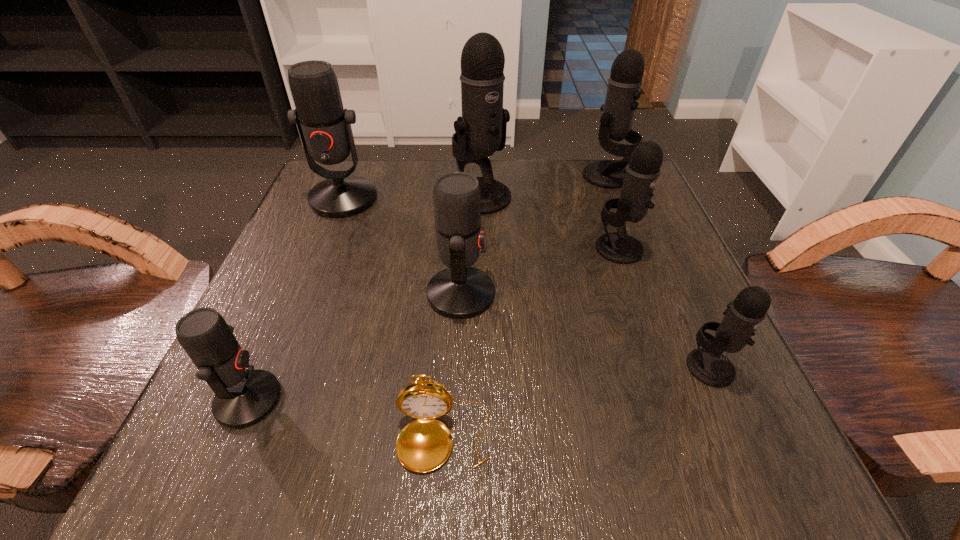
The image size is (960, 540). Identify the location of free spot between the second nearest black microphone and the nearest black microphone. (664, 308).

Find the location of `unoccupied area between the nearest red microphone and the shortest object`. unoccupied area between the nearest red microphone and the shortest object is located at coordinates (346, 418).

At what (x,y) coordinates should I click in order to perform the action: click on free spot between the tallest object and the third biggest black microphone. Please return your answer as a coordinate pair (x, y). This screenshot has width=960, height=540. Looking at the image, I should click on (550, 222).

Identify the location of vacant space in between the rightmost red microphone and the third smallest black microphone. (534, 235).

Where is `empty space that is in between the smallest black microphone and the farthest red microphone`? empty space that is in between the smallest black microphone and the farthest red microphone is located at coordinates (527, 283).

I want to click on free space between the smallest red microphone and the fourth nearest object, so click(x=354, y=347).

Where is `free space between the second nearest black microphone and the smallest red microphone`? The width and height of the screenshot is (960, 540). free space between the second nearest black microphone and the smallest red microphone is located at coordinates (434, 324).

Identify which object is located as the fifth nearest to the biggest red microphone. Please provide its 2D coordinates. Your answer should be formatted as a tuple, i.e. [(x, y)], where the tuple contains the x and y coordinates of a point satisfying the conditions above.

[(641, 174)]

Choose which object is the fifth nearest neighbor to the shortest object. Please provide its 2D coordinates. Your answer should be formatted as a tuple, i.e. [(x, y)], where the tuple contains the x and y coordinates of a point satisfying the conditions above.

[(481, 131)]

You are a GUI agent. You are given a task and a screenshot of the screen. Output one action in this format:
    pyautogui.click(x=<x>, y=<y>)
    Task: Click on the third closest microphone to the shortest object
    Image resolution: width=960 pixels, height=540 pixels.
    Given the screenshot: What is the action you would take?
    pyautogui.click(x=708, y=365)